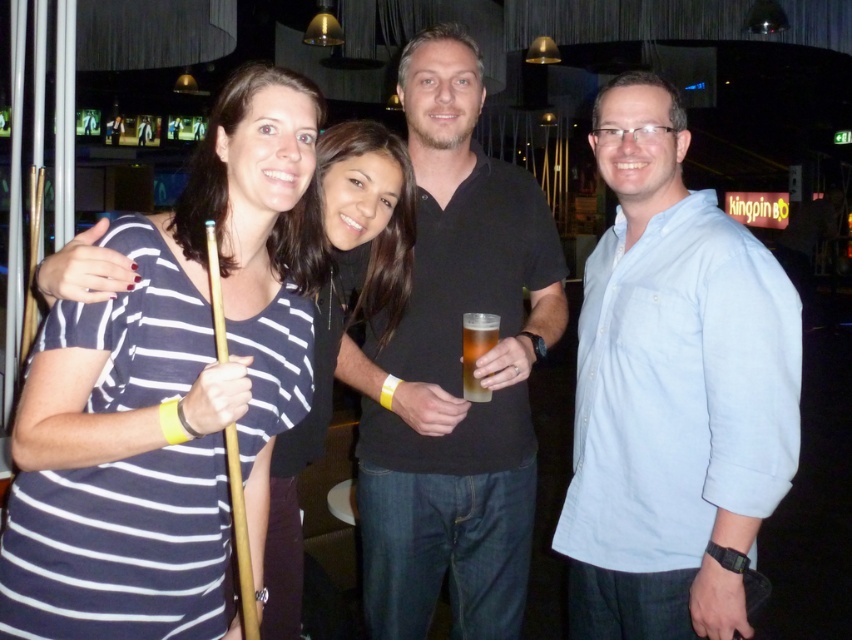
You are a bartender who needs to place a new drink order. You see the striped fabric shirt at center and the translucent plastic cup at center in the image. Which object is taller so you can decide where to place the drink?

The striped fabric shirt at center is taller than the translucent plastic cup at center, so the drink should be placed on the shirt.

You are standing in the bar and want to move from the point at coordinates point (726, 563) to the point at coordinates point (399, 406). Since you can only move forward, will you need to walk towards the camera or away from it?

Since point (726, 563) is closer to the camera than point (399, 406), you will need to walk away from the camera to reach the destination point.